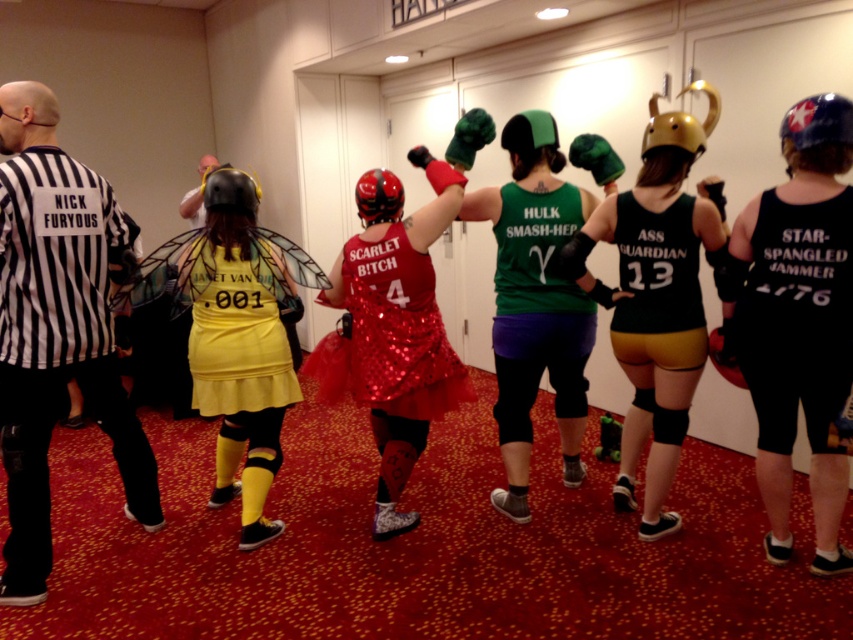
Question: Is shiny sequined skirt at center below blue matte helmet at upper right?

Choices:
 (A) yes
 (B) no

Answer: (A)

Question: Is black matte tank top at center wider than blue matte helmet at upper right?

Choices:
 (A) no
 (B) yes

Answer: (B)

Question: Is metallic gold helmet at center to the right of black matte helmet at center from the viewer's perspective?

Choices:
 (A) no
 (B) yes

Answer: (B)

Question: Which object is positioned farthest from the blue matte helmet at upper right?

Choices:
 (A) black matte tank top at center
 (B) shiny red helmet at center
 (C) green matte roller skate at center

Answer: (C)

Question: Which point appears farthest from the camera in this image?

Choices:
 (A) (210, 202)
 (B) (619, 280)

Answer: (B)

Question: Among these points, which one is farthest from the camera?

Choices:
 (A) (364, 196)
 (B) (810, 173)
 (C) (62, 228)

Answer: (A)